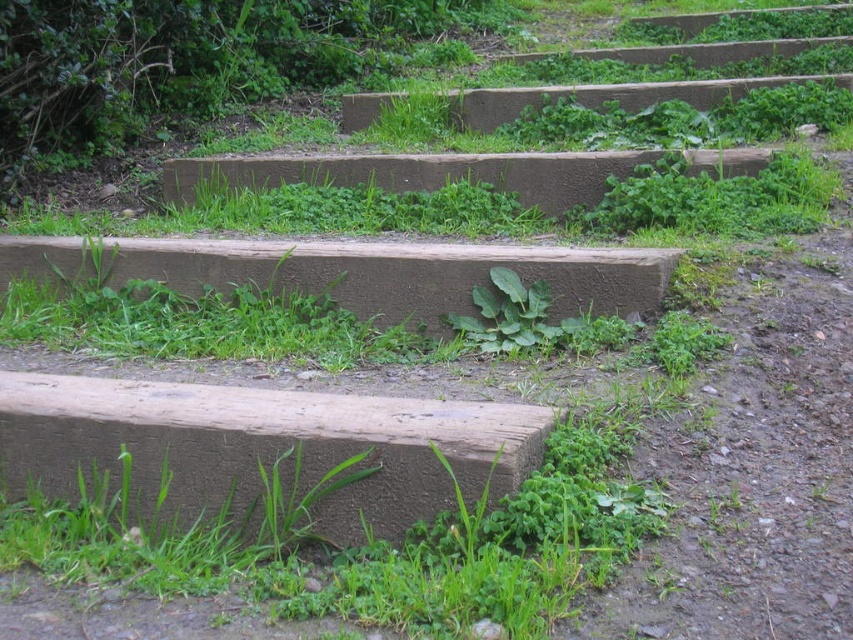
You are standing at the base of the wooden steps leading up the slope. You want to place a 4.5 feet long ladder between the brown rough concrete at lower left and the camera. Is there enough space? Please answer based on the distance between them.

The brown rough concrete at lower left and camera are 4.00 feet apart from each other. Since the ladder is 4.5 feet long, which is longer than the available space, it won

You are a gardener trying to clear a path. You see the brown rough concrete at center and the green leafy plant at center. Which one takes up more space in the middle of the path?

The brown rough concrete at center has a larger size compared to the green leafy plant at center, so it takes up more space in the middle of the path.